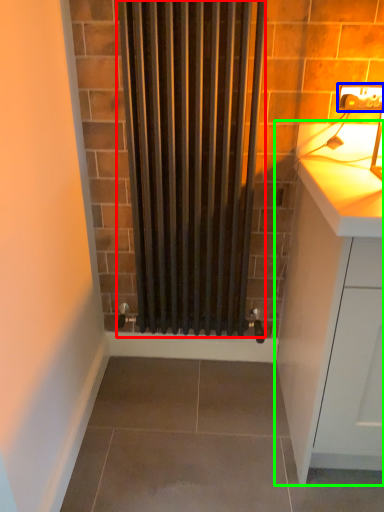
Question: Which is nearer to the shower curtain (highlighted by a red box)? electric outlet (highlighted by a blue box) or cabinetry (highlighted by a green box).

Choices:
 (A) electric outlet
 (B) cabinetry

Answer: (B)